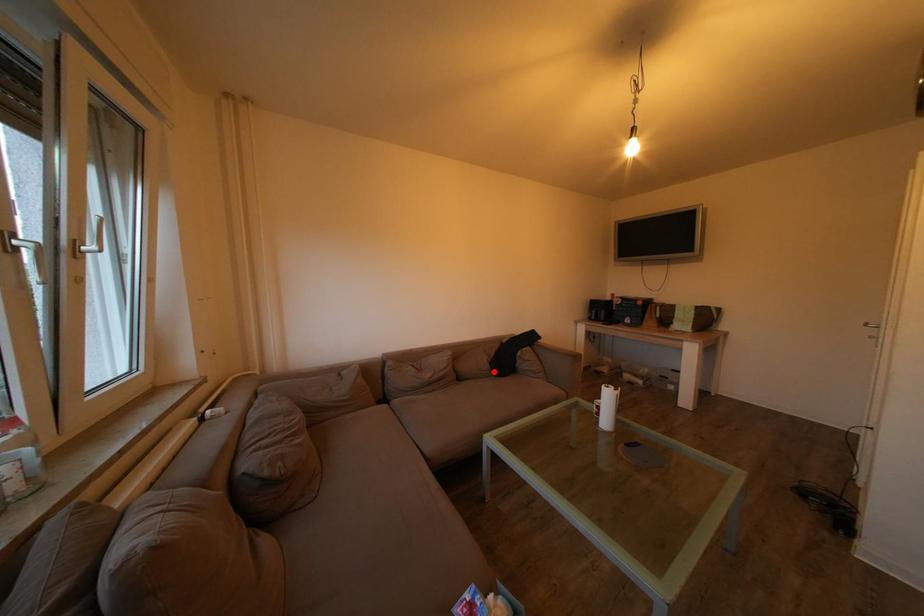
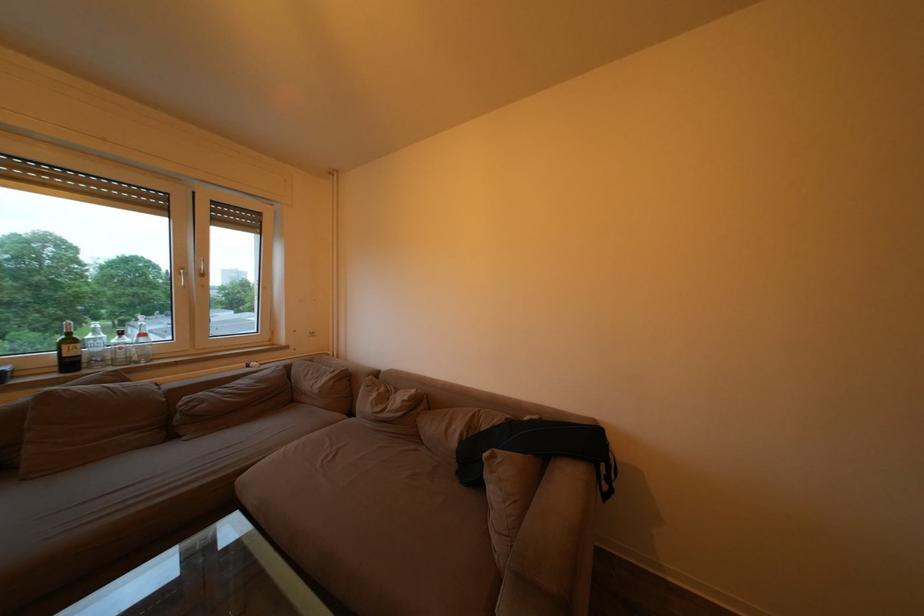
Find the pixel in the second image that matches the highlighted location in the first image.

(463, 448)